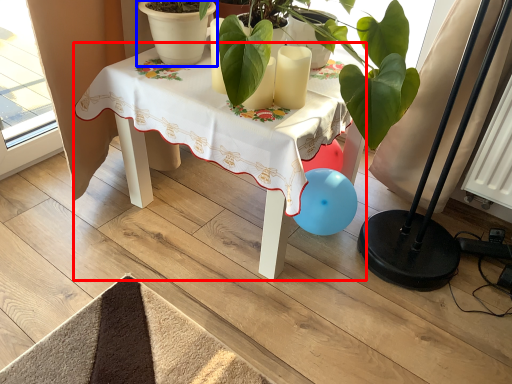
Question: Which point is further to the camera, table (highlighted by a red box) or flowerpot (highlighted by a blue box)?

Choices:
 (A) table
 (B) flowerpot

Answer: (B)